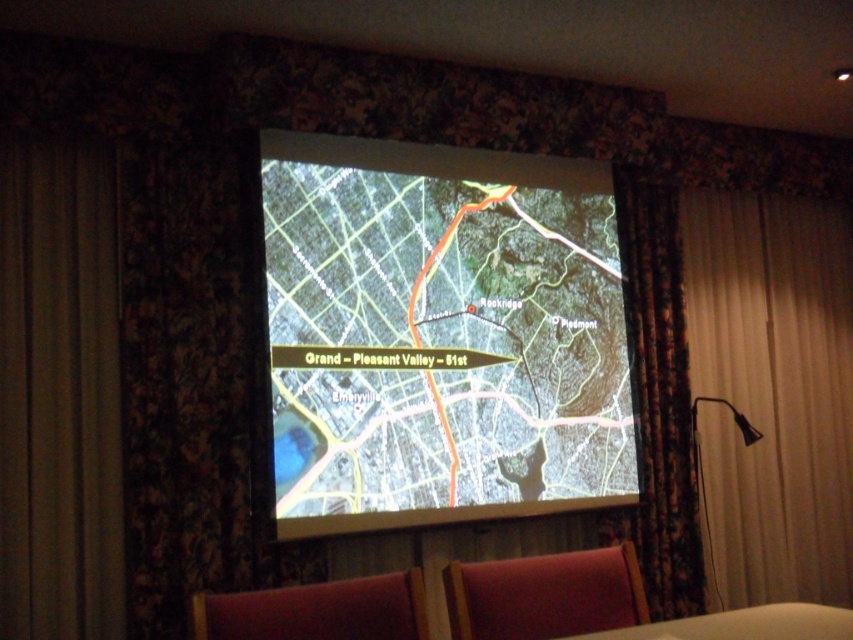
From the picture: Can you confirm if white fabric curtain at right is positioned to the left of black fabric lamp at lower right?

No, white fabric curtain at right is not to the left of black fabric lamp at lower right.

Between point (733, 342) and point (698, 468), which one is positioned in front?

Point (698, 468)

Between point (839, 362) and point (697, 449), which one is positioned behind?

Positioned behind is point (839, 362).

This screenshot has height=640, width=853. In order to click on white fabric curtain at right in this screenshot , I will do `click(772, 392)`.

Which of these two, green textured map at center or white fabric curtain at right, stands shorter?

With less height is green textured map at center.

Is green textured map at center below white fabric curtain at right?

Actually, green textured map at center is above white fabric curtain at right.

The height and width of the screenshot is (640, 853). I want to click on green textured map at center, so click(x=440, y=336).

Who is positioned more to the left, green textured map at center or velvet red chair at lower center?

From the viewer's perspective, velvet red chair at lower center appears more on the left side.

Does point (323, 250) lie behind point (302, 636)?

Yes.

This screenshot has height=640, width=853. Identify the location of green textured map at center. (440, 336).